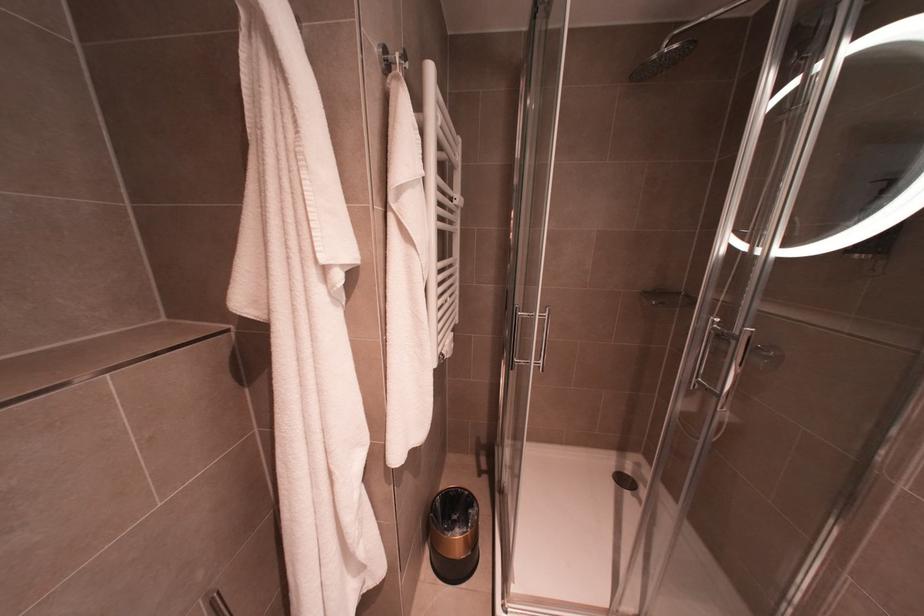
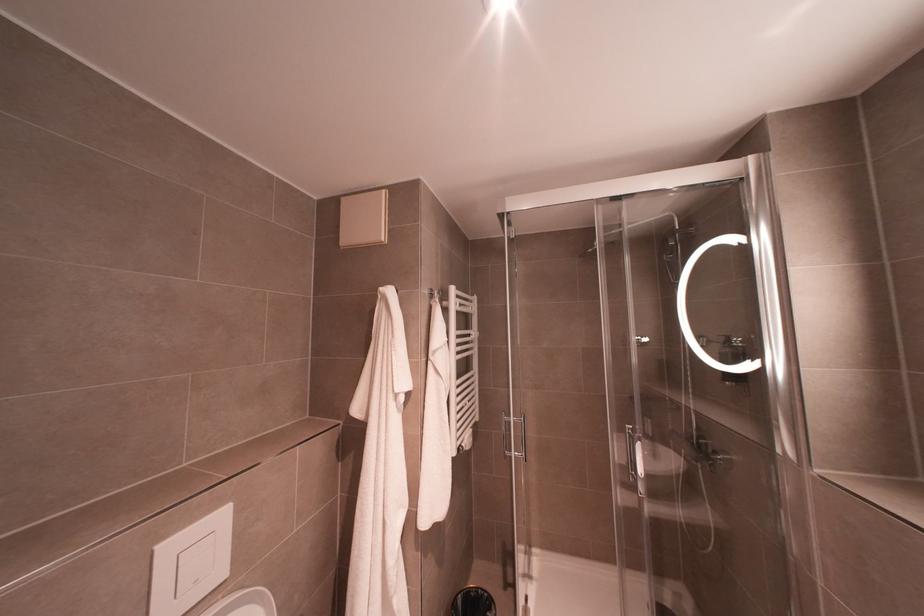
Where in the second image is the point corresponding to (x=470, y=506) from the first image?

(489, 608)